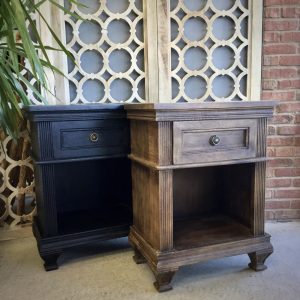
Locate an element on the screen. The image size is (300, 300). floor is located at coordinates 253,296.